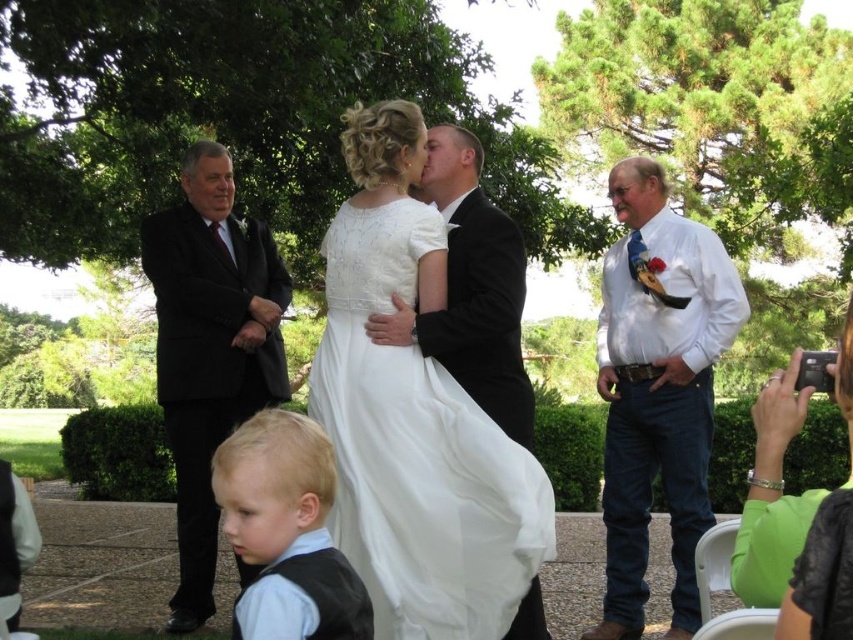
Question: Does white shirt at right appear over black suit at left?

Choices:
 (A) no
 (B) yes

Answer: (A)

Question: Among these objects, which one is farthest from the camera?

Choices:
 (A) blonde hair vest at lower left
 (B) green fabric flower girl at lower right
 (C) satin/sheer white dress at center

Answer: (C)

Question: Which object is the farthest from the white shirt at right?

Choices:
 (A) black suit at left
 (B) blonde hair vest at lower left

Answer: (B)

Question: Does blonde hair vest at lower left appear on the left side of green fabric flower girl at lower right?

Choices:
 (A) yes
 (B) no

Answer: (A)

Question: Is satin/sheer white dress at center positioned in front of white shirt at right?

Choices:
 (A) yes
 (B) no

Answer: (A)

Question: Which of the following is the closest to the observer?

Choices:
 (A) (483, 561)
 (B) (173, 609)
 (C) (642, 288)

Answer: (A)